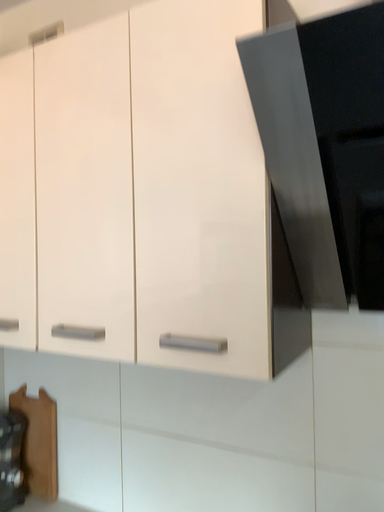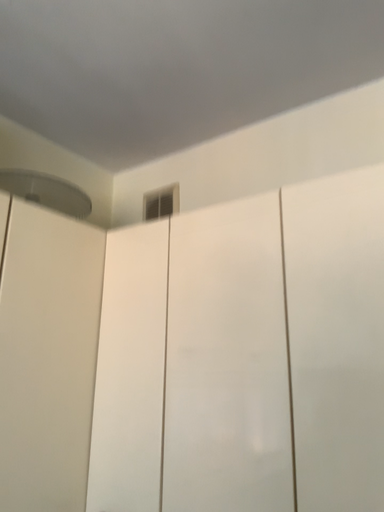
Question: Which way did the camera rotate in the video?

Choices:
 (A) rotated upward
 (B) rotated downward

Answer: (A)